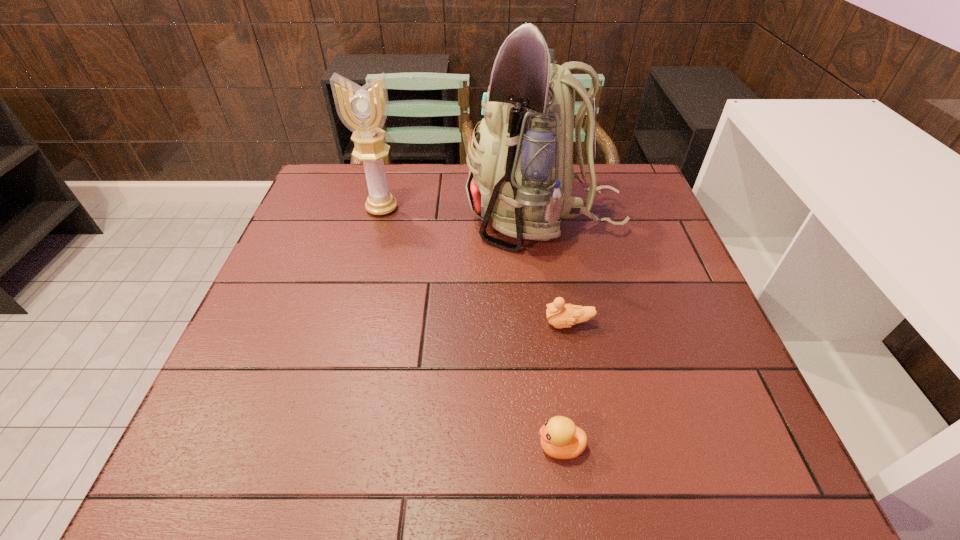
At what (x,y) coordinates should I click in order to perform the action: click on free point at the far edge. Please return your answer as a coordinate pair (x, y). This screenshot has height=540, width=960. Looking at the image, I should click on (427, 177).

At what (x,y) coordinates should I click in order to perform the action: click on vacant space at the near edge of the desktop. Please return your answer as a coordinate pair (x, y). This screenshot has width=960, height=540. Looking at the image, I should click on (566, 476).

In the image, there is a desktop. Where is `vacant space at the left edge`? This screenshot has height=540, width=960. vacant space at the left edge is located at coordinates (331, 278).

Where is `free region at the right edge`? This screenshot has height=540, width=960. free region at the right edge is located at coordinates (625, 243).

This screenshot has width=960, height=540. In the image, there is a desktop. What are the coordinates of `vacant space at the far left corner` in the screenshot? It's located at (334, 205).

This screenshot has width=960, height=540. Identify the location of vacant space at the far right corner of the desktop. (625, 168).

Locate an element on the screen. The image size is (960, 540). free space between the nearer duckling and the backpack is located at coordinates (552, 333).

Find the location of a particular element. The width and height of the screenshot is (960, 540). vacant area that lies between the tallest object and the nearer duckling is located at coordinates (552, 333).

Locate an element on the screen. The width and height of the screenshot is (960, 540). free space that is in between the nearest object and the tallest object is located at coordinates (552, 333).

Where is `vacant space that's between the tallest object and the nearer duckling`? The width and height of the screenshot is (960, 540). vacant space that's between the tallest object and the nearer duckling is located at coordinates (552, 333).